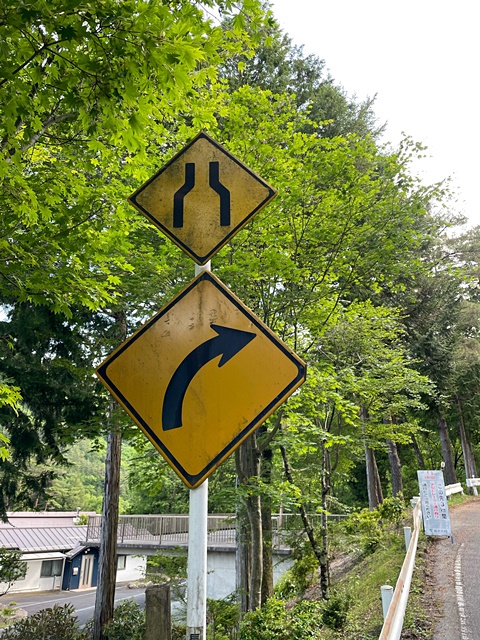
The height and width of the screenshot is (640, 480). Identify the location of blue entryway. (75, 564), (95, 573).